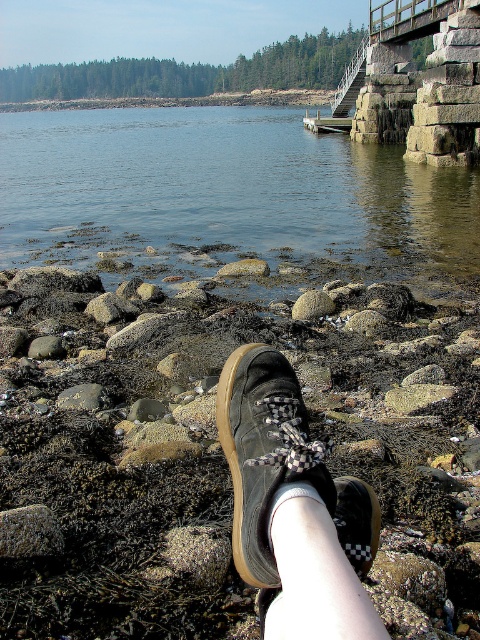
Question: Does clear water at lower center appear under matte black shoe at lower center?

Choices:
 (A) no
 (B) yes

Answer: (A)

Question: Does matte black shoe at lower center have a larger size compared to black checkered shoe at lower center?

Choices:
 (A) no
 (B) yes

Answer: (B)

Question: Which of the following is the closest to the observer?

Choices:
 (A) matte black shoe at lower center
 (B) rusty stone at lower center

Answer: (A)

Question: Which object appears closest to the camera in this image?

Choices:
 (A) matte black shoe at lower center
 (B) clear water at lower center
 (C) black checkered shoe at lower center
 (D) rusty stone at lower center

Answer: (A)

Question: Is matte black shoe at lower center bigger than black checkered shoe at lower center?

Choices:
 (A) yes
 (B) no

Answer: (A)

Question: Among these objects, which one is farthest from the camera?

Choices:
 (A) clear water at lower center
 (B) rusty stone at lower center
 (C) black checkered shoe at lower center

Answer: (A)